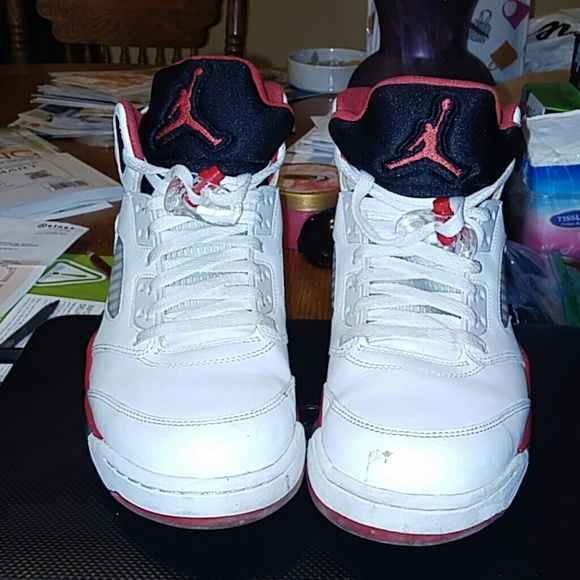
Identify the location of pen. (99, 257).